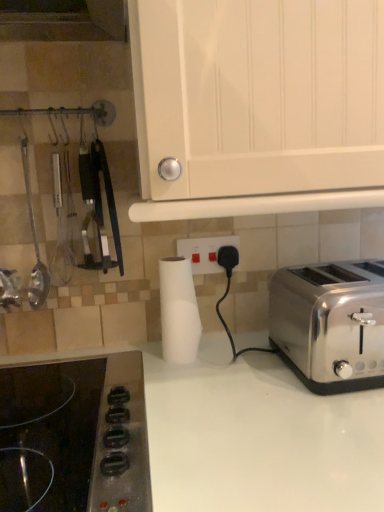
The width and height of the screenshot is (384, 512). Find the location of `white plastic power outlet at center`. white plastic power outlet at center is located at coordinates (205, 252).

Measure the distance between satin silver toaster at right and camera.

The depth of satin silver toaster at right is 69.95 centimeters.

The image size is (384, 512). What are the coordinates of `black glass cooktop at lower left` in the screenshot? It's located at (75, 436).

You are a GUI agent. You are given a task and a screenshot of the screen. Output one action in this format:
    pyautogui.click(x=<x>, y=<y>)
    Task: Click on the white plastic power outlet at center
    
    Given the screenshot: What is the action you would take?
    pyautogui.click(x=205, y=252)

Is point (289, 361) closer to viewer compared to point (197, 238)?

Yes, it is in front of point (197, 238).

Considering the relative sizes of satin silver toaster at right and white plastic power outlet at center in the image provided, is satin silver toaster at right smaller than white plastic power outlet at center?

No, satin silver toaster at right is not smaller than white plastic power outlet at center.

Looking at this image, from the image's perspective, between satin silver toaster at right and white plastic power outlet at center, which one is located above?

white plastic power outlet at center appears higher in the image.

How distant is satin silver toaster at right from white plastic power outlet at center?

satin silver toaster at right is 10.40 inches away from white plastic power outlet at center.

Is there a large distance between black glass cooktop at lower left and satin silver toaster at right?

Actually, black glass cooktop at lower left and satin silver toaster at right are a little close together.

In terms of size, does black glass cooktop at lower left appear bigger or smaller than satin silver toaster at right?

In the image, black glass cooktop at lower left appears to be smaller than satin silver toaster at right.

Based on the photo, from a real-world perspective, is black glass cooktop at lower left below satin silver toaster at right?

Yes, from a real-world perspective, black glass cooktop at lower left is below satin silver toaster at right.

Is satin silver toaster at right a part of black glass cooktop at lower left?

No, satin silver toaster at right is located outside of black glass cooktop at lower left.

Could you tell me if white glossy cabinet at upper center is turned towards white plastic power outlet at center?

No, white glossy cabinet at upper center is not aimed at white plastic power outlet at center.

Is white glossy cabinet at upper center thinner than white plastic power outlet at center?

Incorrect, the width of white glossy cabinet at upper center is not less than that of white plastic power outlet at center.

From a real-world perspective, is white glossy cabinet at upper center above or below white plastic power outlet at center?

white glossy cabinet at upper center is situated higher than white plastic power outlet at center in the real world.

How different are the orientations of white glossy cabinet at upper center and white plastic power outlet at center in degrees?

0.428 degrees.

Is white plastic power outlet at center in contact with white glossy cabinet at upper center?

No, white plastic power outlet at center is not making contact with white glossy cabinet at upper center.

Visually, is white plastic power outlet at center positioned to the left or to the right of white glossy cabinet at upper center?

white plastic power outlet at center is positioned on white glossy cabinet at upper center's left side.

Between white plastic power outlet at center and white glossy cabinet at upper center, which one has larger size?

white glossy cabinet at upper center.

Is black glass cooktop at lower left positioned with its back to white matte paper towel at center?

No, black glass cooktop at lower left is not facing away from white matte paper towel at center.

Between black glass cooktop at lower left and white matte paper towel at center, which one appears on the left side from the viewer's perspective?

black glass cooktop at lower left.

Is black glass cooktop at lower left outside of white matte paper towel at center?

Yes.

How many degrees apart are the facing directions of black glass cooktop at lower left and white matte paper towel at center?

The angle between the facing direction of black glass cooktop at lower left and the facing direction of white matte paper towel at center is 2.62 degrees.

Are white matte paper towel at center and white plastic power outlet at center making contact?

white matte paper towel at center and white plastic power outlet at center are not in contact.

Which of these two, white matte paper towel at center or white plastic power outlet at center, stands shorter?

Standing shorter between the two is white plastic power outlet at center.

In order to click on paper towel on the left of the white plastic power outlet at center in this screenshot , I will do `click(178, 311)`.

Between point (191, 283) and point (181, 252), which one is positioned in front?

Positioned in front is point (191, 283).

In the image, is white plastic power outlet at center positioned in front of or behind white matte paper towel at center?

In the image, white plastic power outlet at center appears behind white matte paper towel at center.

Visually, is white plastic power outlet at center positioned to the left or to the right of white matte paper towel at center?

Clearly, white plastic power outlet at center is on the right of white matte paper towel at center in the image.

Which object is thinner, white plastic power outlet at center or white matte paper towel at center?

white plastic power outlet at center is thinner.

Find the location of `power outlet that appears behind the white matte paper towel at center`. power outlet that appears behind the white matte paper towel at center is located at coordinates (205, 252).

Find the location of a particular element. This screenshot has width=384, height=512. toaster below the white plastic power outlet at center (from the image's perspective) is located at coordinates (330, 324).

You are a GUI agent. You are given a task and a screenshot of the screen. Output one action in this format:
    pyautogui.click(x=<x>, y=<y>)
    Task: Click on the toaster that is above the black glass cooktop at lower left (from the image's perspective)
    
    Given the screenshot: What is the action you would take?
    pyautogui.click(x=330, y=324)

Which object lies nearer to the anchor point metallic silver ladle at left, white matte paper towel at center or white glossy cabinet at upper center?

white matte paper towel at center lies closer to metallic silver ladle at left than the other object.

Estimate the real-world distances between objects in this image. Which object is closer to white glossy cabinet at upper center, black glass cooktop at lower left or metallic silver ladle at left?

The object closer to white glossy cabinet at upper center is black glass cooktop at lower left.

Estimate the real-world distances between objects in this image. Which object is closer to metallic silver ladle at left, white plastic power outlet at center or black glass cooktop at lower left?

black glass cooktop at lower left.

Looking at this image, when comparing their distances from satin silver toaster at right, does metallic silver ladle at left or black glass cooktop at lower left seem further?

metallic silver ladle at left is further to satin silver toaster at right.

Which object lies further to the anchor point black glass cooktop at lower left, white glossy cabinet at upper center or white plastic power outlet at center?

white glossy cabinet at upper center.

Based on their spatial positions, is white plastic power outlet at center or white glossy cabinet at upper center closer to black glass cooktop at lower left?

Among the two, white plastic power outlet at center is located nearer to black glass cooktop at lower left.

From the image, which object appears to be nearer to satin silver toaster at right, white glossy cabinet at upper center or black glass cooktop at lower left?

white glossy cabinet at upper center.

Consider the image. Considering their positions, is white glossy cabinet at upper center positioned closer to metallic silver ladle at left than white plastic power outlet at center?

white plastic power outlet at center is closer to metallic silver ladle at left.

Locate an element on the screen. Image resolution: width=384 pixels, height=512 pixels. power outlet between metallic silver ladle at left and satin silver toaster at right from left to right is located at coordinates (205, 252).

Locate an element on the screen. appliance between white glossy cabinet at upper center and black glass cooktop at lower left in the up-down direction is located at coordinates (34, 244).

I want to click on power outlet between white glossy cabinet at upper center and black glass cooktop at lower left vertically, so click(x=205, y=252).

You are a GUI agent. You are given a task and a screenshot of the screen. Output one action in this format:
    pyautogui.click(x=<x>, y=<y>)
    Task: Click on the paper towel positioned between white glossy cabinet at upper center and white plastic power outlet at center from near to far
    This screenshot has width=384, height=512.
    Given the screenshot: What is the action you would take?
    pyautogui.click(x=178, y=311)